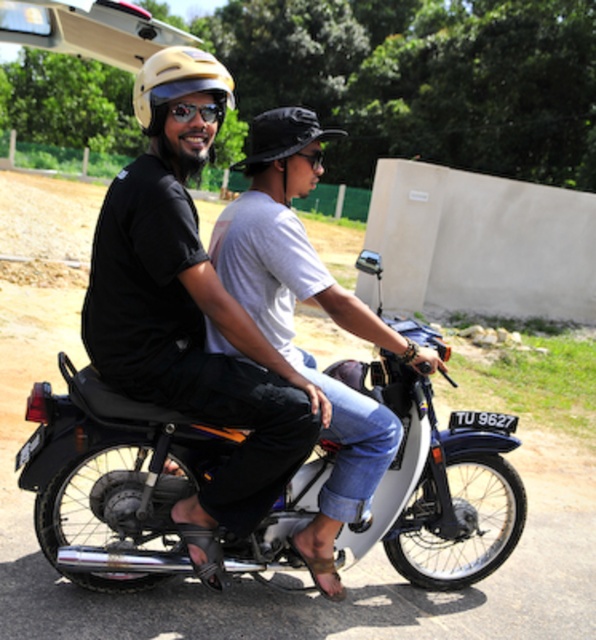
You are a photographer trying to capture a clear shot of both the matte black helmet at upper left and the brushed metal goggles at upper center in the image. Since you want to ensure both items are in focus, you need to know which one is bigger. Can you tell me which object is larger?

The matte black helmet at upper left is larger in size than the brushed metal goggles at upper center, so the matte black helmet at upper left is bigger.

From the picture: You are a photographer trying to capture a clear photo of both the matte yellow helmet at upper left and the black matte bucket hat at center. Since you want to ensure both are in focus, you need to know which object is taller. Can you determine which one is taller?

The matte yellow helmet at upper left is much taller than the black matte bucket hat at center, so you should focus on the matte yellow helmet at upper left first as it requires more space in the frame due to its height.

You are a photographer trying to capture both the matte black helmet at upper left and the black matte bucket hat at center in a single shot. Which object should you adjust your camera focus on first if you want to ensure both are in frame?

The matte black helmet at upper left is smaller than the black matte bucket hat at center, so you should focus on the larger object, the black matte bucket hat at center first to ensure both fit in the frame.